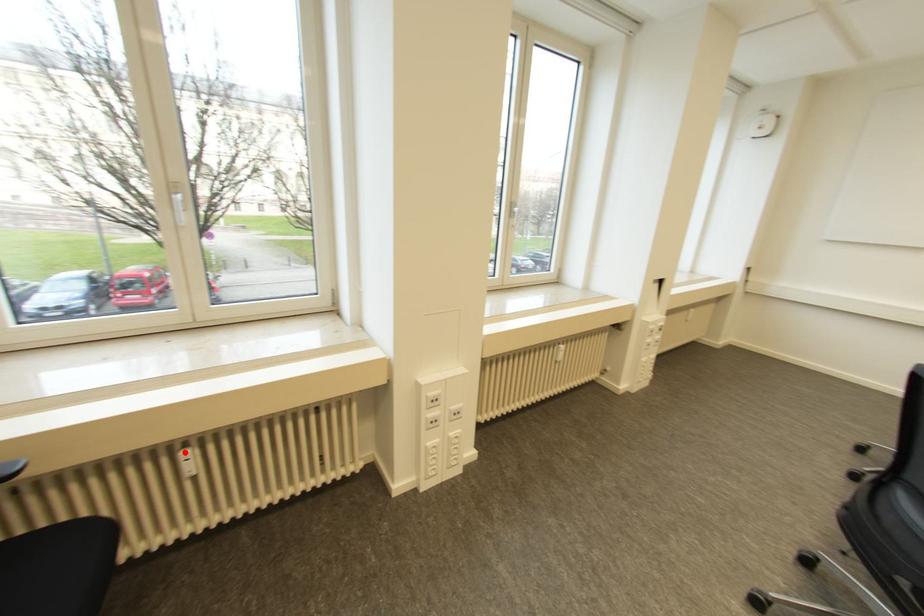
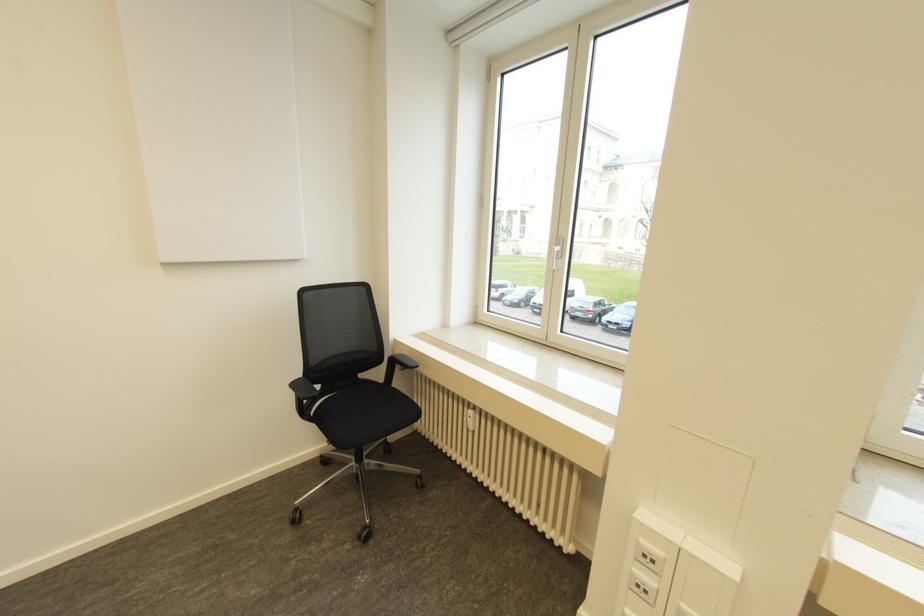
Locate, in the second image, the point that corresponds to the highlighted location in the first image.

(469, 411)